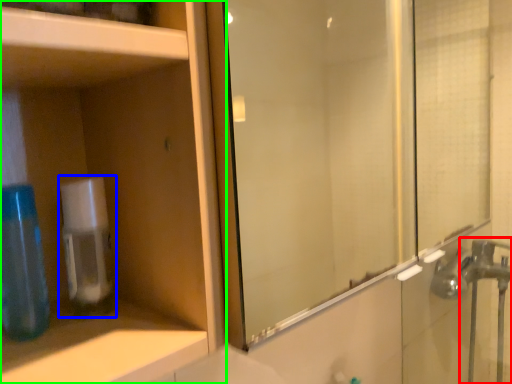
Question: Which is nearer to the faucet (highlighted by a red box)? soap dispenser (highlighted by a blue box) or cabinetry (highlighted by a green box).

Choices:
 (A) soap dispenser
 (B) cabinetry

Answer: (B)